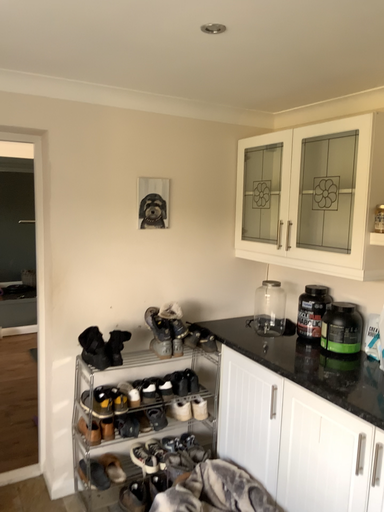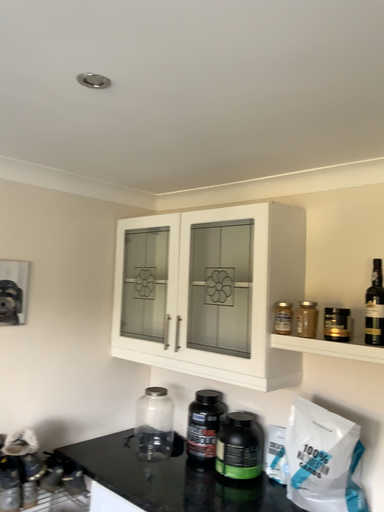
Question: Which way did the camera rotate in the video?

Choices:
 (A) rotated right
 (B) rotated left

Answer: (A)